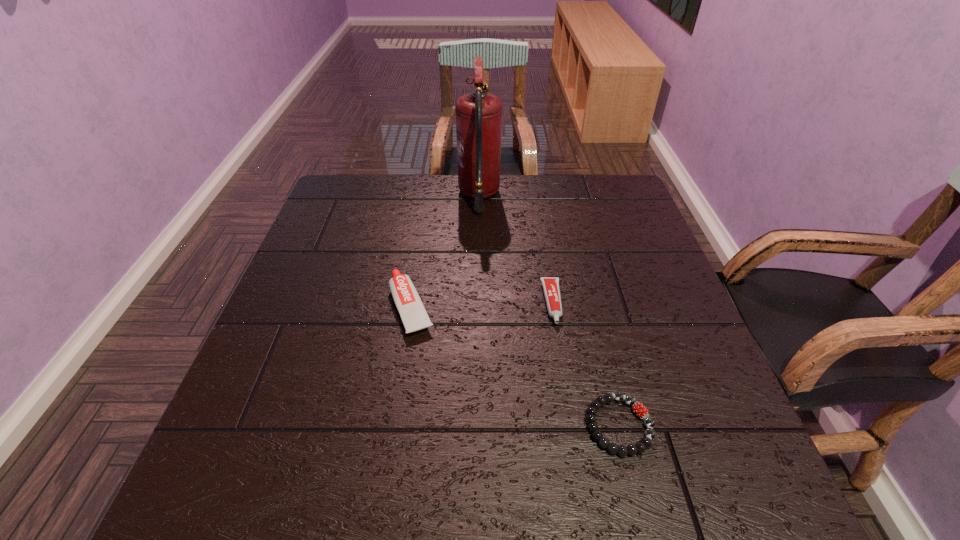
Where is `vacant point located between the second shortest object and the fire extinguisher`? vacant point located between the second shortest object and the fire extinguisher is located at coordinates (516, 249).

Image resolution: width=960 pixels, height=540 pixels. I want to click on object that is the closest one to the tallest object, so click(411, 309).

Locate an element on the screen. object identified as the closest to the second object from right to left is located at coordinates (640, 410).

Image resolution: width=960 pixels, height=540 pixels. In order to click on blank space that satisfies the following two spatial constraints: 1. at the front of the nearest object where the nozzle is aimed; 2. on the left side of the fire extinguisher in this screenshot , I will do `click(478, 425)`.

The width and height of the screenshot is (960, 540). Find the location of `vacant point that satisfies the following two spatial constraints: 1. at the front of the second object from left to right where the nozzle is aimed; 2. on the right side of the rightmost object`. vacant point that satisfies the following two spatial constraints: 1. at the front of the second object from left to right where the nozzle is aimed; 2. on the right side of the rightmost object is located at coordinates (478, 425).

Locate an element on the screen. The height and width of the screenshot is (540, 960). blank area in the image that satisfies the following two spatial constraints: 1. at the front of the tallest object where the nozzle is aimed; 2. on the right side of the nearest object is located at coordinates (478, 425).